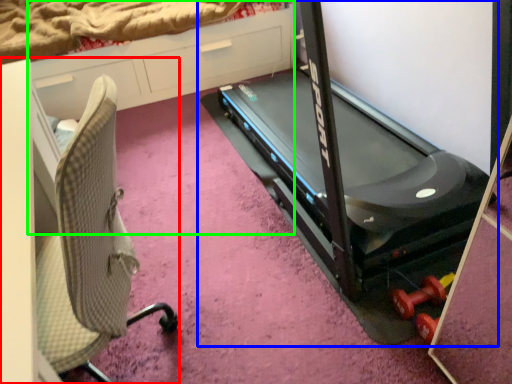
Question: Estimate the real-world distances between objects in this image. Which object is farther from furniture (highlighted by a red box), treadmill (highlighted by a blue box) or dresser (highlighted by a green box)?

Choices:
 (A) treadmill
 (B) dresser

Answer: (B)